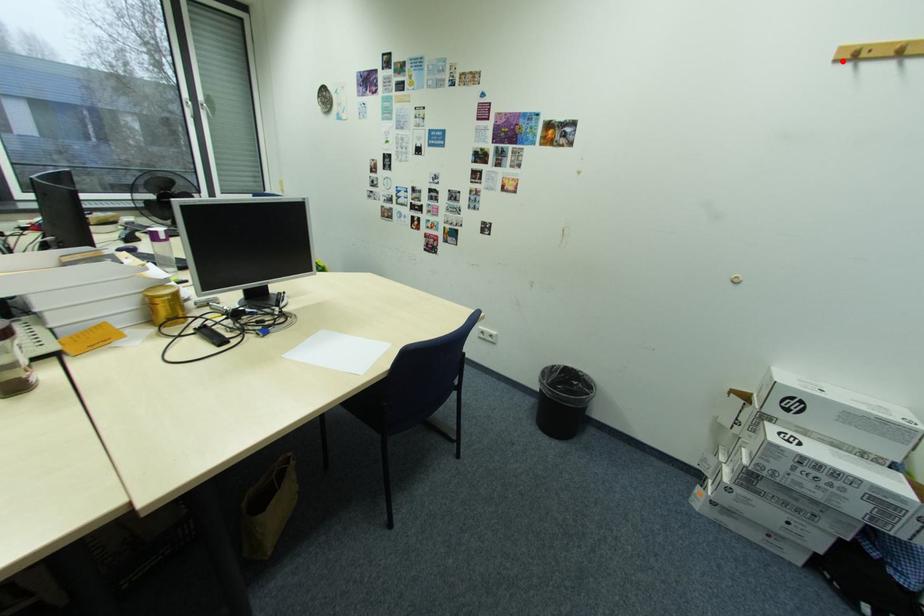
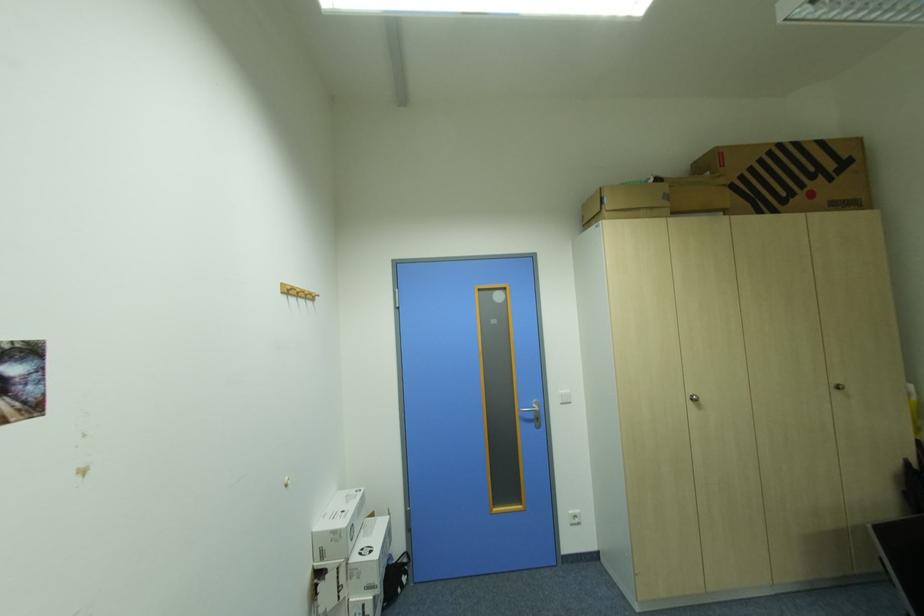
Find the pixel in the second image that matches the highlighted location in the first image.

(292, 293)